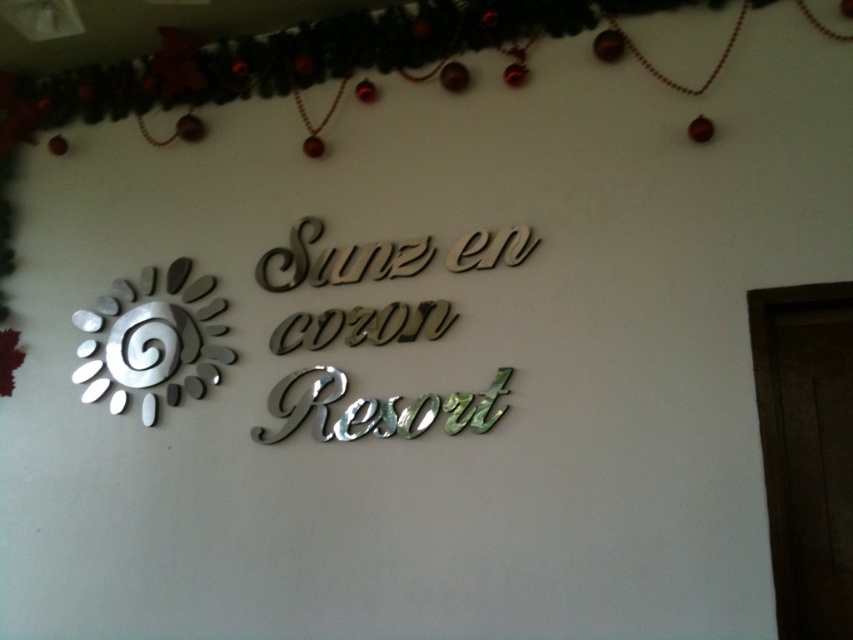
Is silver/metallic sign at center closer to camera compared to silver metallic sun at left?

Yes, it is.

Which is above, silver/metallic sign at center or silver metallic sun at left?

silver/metallic sign at center

Identify the location of silver/metallic sign at center. The height and width of the screenshot is (640, 853). click(x=376, y=408).